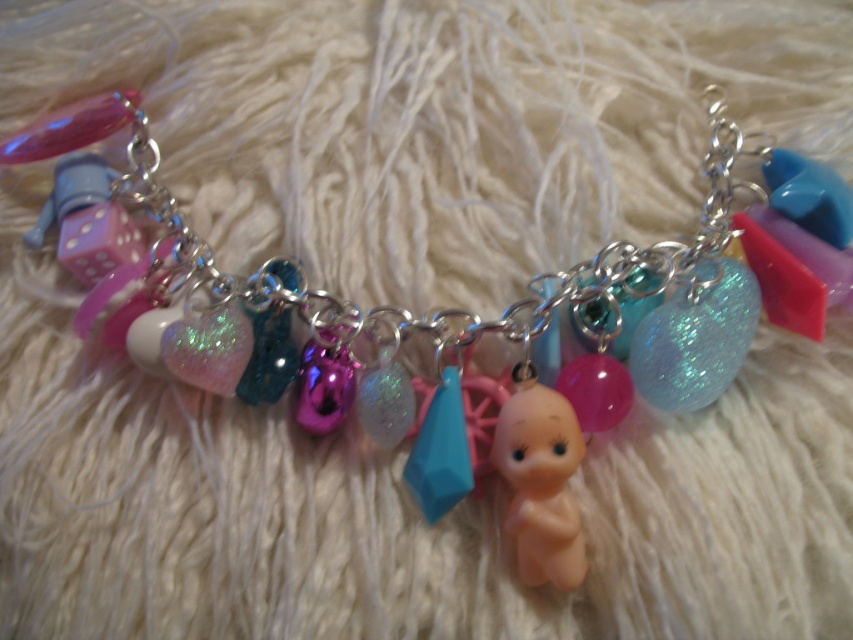
Is pink rubber doll at center taller than glittery blue sphere at center?

Correct, pink rubber doll at center is much taller as glittery blue sphere at center.

Image resolution: width=853 pixels, height=640 pixels. What do you see at coordinates (541, 483) in the screenshot?
I see `pink rubber doll at center` at bounding box center [541, 483].

Is point (541, 556) closer to camera compared to point (695, 372)?

Yes, point (541, 556) is closer to viewer.

The image size is (853, 640). I want to click on pink rubber doll at center, so click(541, 483).

Between pink rubber doll at center and pink matte dice at center, which one appears on the left side from the viewer's perspective?

Positioned to the left is pink matte dice at center.

Is point (567, 474) less distant than point (131, 221)?

That is True.

Does point (573, 561) come behind point (90, 246)?

No, it is in front of (90, 246).

Locate an element on the screen. pink rubber doll at center is located at coordinates (541, 483).

Locate an element on the screen. The image size is (853, 640). glittery blue sphere at center is located at coordinates (695, 337).

Who is more distant from viewer, (711, 369) or (84, 244)?

Point (84, 244)

Who is more forward, [679,333] or [107,228]?

Point [679,333]

Where is `glittery blue sphere at center`? glittery blue sphere at center is located at coordinates (695, 337).